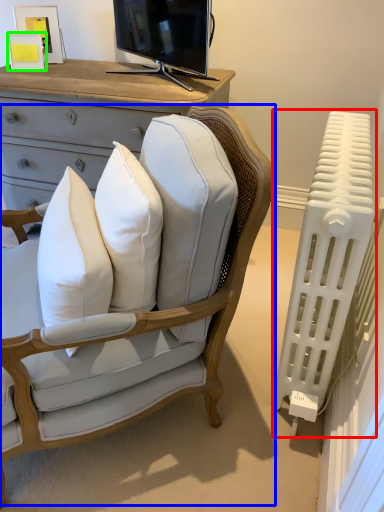
Question: Which object is the closest to the radiator (highlighted by a red box)? Choose among these: chair (highlighted by a blue box) or picture frame (highlighted by a green box).

Choices:
 (A) chair
 (B) picture frame

Answer: (A)